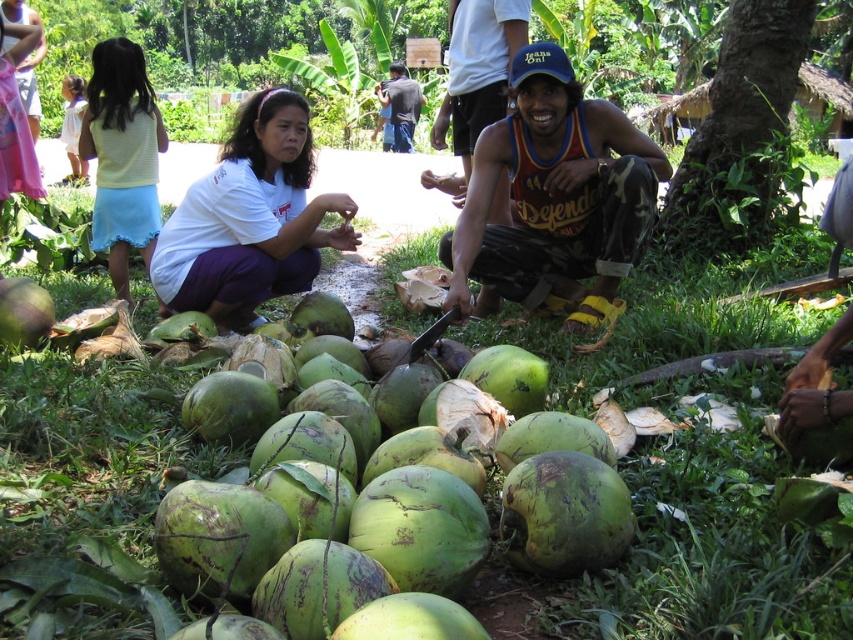
Looking at this image, what object is located at the coordinate point (x=250, y=220) in the image?

The white matte shirt at center is located at the coordinate point (x=250, y=220).